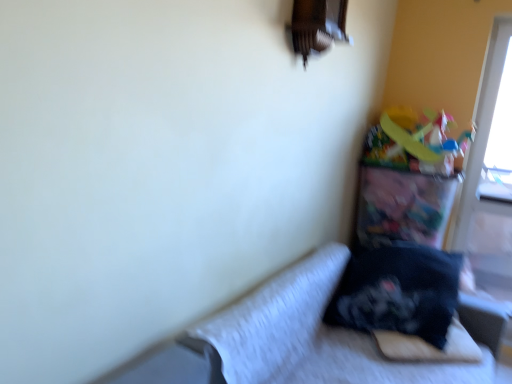
Find the location of `velvet black pillow at lower right`. velvet black pillow at lower right is located at coordinates (328, 335).

What do you see at coordinates (328, 335) in the screenshot? This screenshot has height=384, width=512. I see `velvet black pillow at lower right` at bounding box center [328, 335].

The width and height of the screenshot is (512, 384). Find the location of `transparent plastic screen door at right`. transparent plastic screen door at right is located at coordinates (490, 163).

The image size is (512, 384). What are the coordinates of `velvet black pillow at lower right` in the screenshot? It's located at (328, 335).

In the image, is velvet black pillow at lower right positioned in front of or behind black soft pillow at lower right?

In the image, velvet black pillow at lower right appears in front of black soft pillow at lower right.

Is velvet black pillow at lower right turned away from black soft pillow at lower right?

No, velvet black pillow at lower right is not facing the opposite direction of black soft pillow at lower right.

Considering the relative sizes of velvet black pillow at lower right and black soft pillow at lower right in the image provided, is velvet black pillow at lower right thinner than black soft pillow at lower right?

No.

Does point (249, 360) lie in front of point (445, 298)?

Yes, it is.

Does point (456, 265) lie behind point (462, 374)?

Yes.

In the scene shown: From a real-world perspective, is black soft pillow at lower right positioned above or below velvet black pillow at lower right?

black soft pillow at lower right is situated higher than velvet black pillow at lower right in the real world.

From the image's perspective, does black soft pillow at lower right appear lower than velvet black pillow at lower right?

No.

Considering the sizes of objects black soft pillow at lower right and velvet black pillow at lower right in the image provided, who is smaller, black soft pillow at lower right or velvet black pillow at lower right?

With smaller size is black soft pillow at lower right.

Who is more distant, black soft pillow at lower right or transparent plastic screen door at right?

Positioned behind is transparent plastic screen door at right.

Considering the points (345, 296) and (500, 275), which point is in front, point (345, 296) or point (500, 275)?

The point (345, 296) is more forward.

Is black soft pillow at lower right taller or shorter than transparent plastic screen door at right?

In the image, black soft pillow at lower right appears to be shorter than transparent plastic screen door at right.

You are a GUI agent. You are given a task and a screenshot of the screen. Output one action in this format:
    pyautogui.click(x=<x>, y=<y>)
    Task: Click on the screen door above the black soft pillow at lower right (from the image's perspective)
    
    Given the screenshot: What is the action you would take?
    pyautogui.click(x=490, y=163)

Where is `screen door behind the velvet black pillow at lower right`? This screenshot has height=384, width=512. screen door behind the velvet black pillow at lower right is located at coordinates (490, 163).

From the image's perspective, would you say velvet black pillow at lower right is shown under transparent plastic screen door at right?

Indeed, from the image's perspective, velvet black pillow at lower right is shown beneath transparent plastic screen door at right.

Is velvet black pillow at lower right at the right side of transparent plastic screen door at right?

In fact, velvet black pillow at lower right is to the left of transparent plastic screen door at right.

Between velvet black pillow at lower right and transparent plastic screen door at right, which one has larger width?

velvet black pillow at lower right is wider.

Does transparent plastic screen door at right have a lesser width compared to velvet black pillow at lower right?

Indeed, transparent plastic screen door at right has a lesser width compared to velvet black pillow at lower right.

Can you confirm if transparent plastic screen door at right is positioned to the right of velvet black pillow at lower right?

Yes, transparent plastic screen door at right is to the right of velvet black pillow at lower right.

From a real-world perspective, is transparent plastic screen door at right physically located above or below velvet black pillow at lower right?

transparent plastic screen door at right is above velvet black pillow at lower right.

Is transparent plastic screen door at right bigger than velvet black pillow at lower right?

Incorrect, transparent plastic screen door at right is not larger than velvet black pillow at lower right.

Is transparent plastic screen door at right wider or thinner than black soft pillow at lower right?

transparent plastic screen door at right is thinner than black soft pillow at lower right.

Is transparent plastic screen door at right at the right side of black soft pillow at lower right?

Indeed, transparent plastic screen door at right is positioned on the right side of black soft pillow at lower right.

Identify the location of screen door above the black soft pillow at lower right (from the image's perspective). (490, 163).

At what (x,y) coordinates should I click in order to perform the action: click on pillow above the velvet black pillow at lower right (from the image's perspective). Please return your answer as a coordinate pair (x, y). The width and height of the screenshot is (512, 384). Looking at the image, I should click on (399, 292).

The width and height of the screenshot is (512, 384). There is a velvet black pillow at lower right. In order to click on pillow above it (from a real-world perspective) in this screenshot , I will do `click(399, 292)`.

From the image, which object appears to be farther from velvet black pillow at lower right, black soft pillow at lower right or transparent plastic screen door at right?

Among the two, transparent plastic screen door at right is located further to velvet black pillow at lower right.

Looking at this image, based on their spatial positions, is velvet black pillow at lower right or black soft pillow at lower right further from transparent plastic screen door at right?

Based on the image, velvet black pillow at lower right appears to be further to transparent plastic screen door at right.

From the image, which object appears to be nearer to transparent plastic screen door at right, black soft pillow at lower right or velvet black pillow at lower right?

black soft pillow at lower right is closer to transparent plastic screen door at right.

Based on their spatial positions, is transparent plastic screen door at right or velvet black pillow at lower right closer to black soft pillow at lower right?

velvet black pillow at lower right.

When comparing their distances from black soft pillow at lower right, does velvet black pillow at lower right or transparent plastic screen door at right seem further?

The object further to black soft pillow at lower right is transparent plastic screen door at right.

Based on their spatial positions, is transparent plastic screen door at right or black soft pillow at lower right further from velvet black pillow at lower right?

transparent plastic screen door at right.

Where is `pillow between velvet black pillow at lower right and transparent plastic screen door at right along the z-axis`? The image size is (512, 384). pillow between velvet black pillow at lower right and transparent plastic screen door at right along the z-axis is located at coordinates (399, 292).